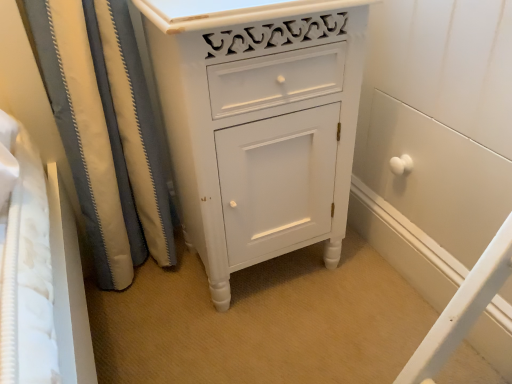
The image size is (512, 384). I want to click on white painted wood cabinet at center, so click(x=258, y=123).

The width and height of the screenshot is (512, 384). What do you see at coordinates (258, 123) in the screenshot?
I see `white painted wood cabinet at center` at bounding box center [258, 123].

Find the location of a particular element. white painted wood cabinet at center is located at coordinates (258, 123).